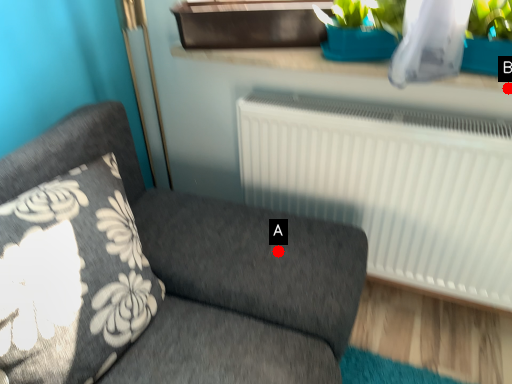
Question: Two points are circled on the image, labeled by A and B beside each circle. Which point is further to the camera?

Choices:
 (A) A is further
 (B) B is further

Answer: (A)